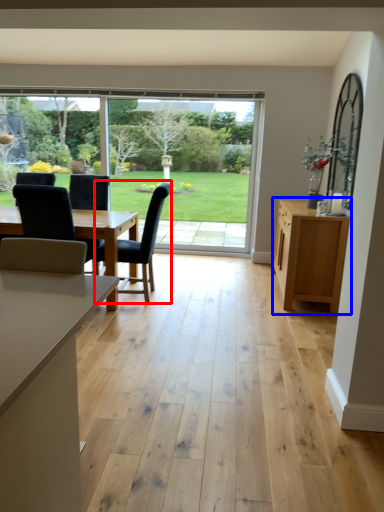
Question: Which object is further to the camera taking this photo, chair (highlighted by a red box) or cabinetry (highlighted by a blue box)?

Choices:
 (A) chair
 (B) cabinetry

Answer: (A)